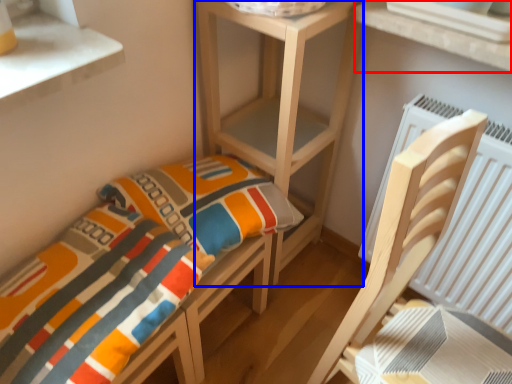
Question: Among these objects, which one is nearest to the camera, window (highlighted by a red box) or shelf (highlighted by a blue box)?

Choices:
 (A) window
 (B) shelf

Answer: (A)